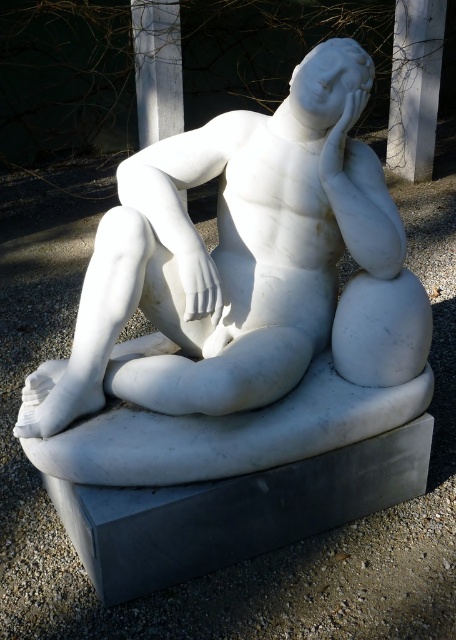
Consider the image. Is white marble statue at center shorter than white marble pillar at upper center?

Yes.

Between white marble statue at center and white marble pillar at upper center, which one is positioned higher?

white marble pillar at upper center is above.

Is point (153, 378) farther from viewer compared to point (404, 132)?

No.

You are a GUI agent. You are given a task and a screenshot of the screen. Output one action in this format:
    pyautogui.click(x=<x>, y=<y>)
    Task: Click on the white marble statue at center
    The width and height of the screenshot is (456, 640).
    Given the screenshot: What is the action you would take?
    pyautogui.click(x=232, y=253)